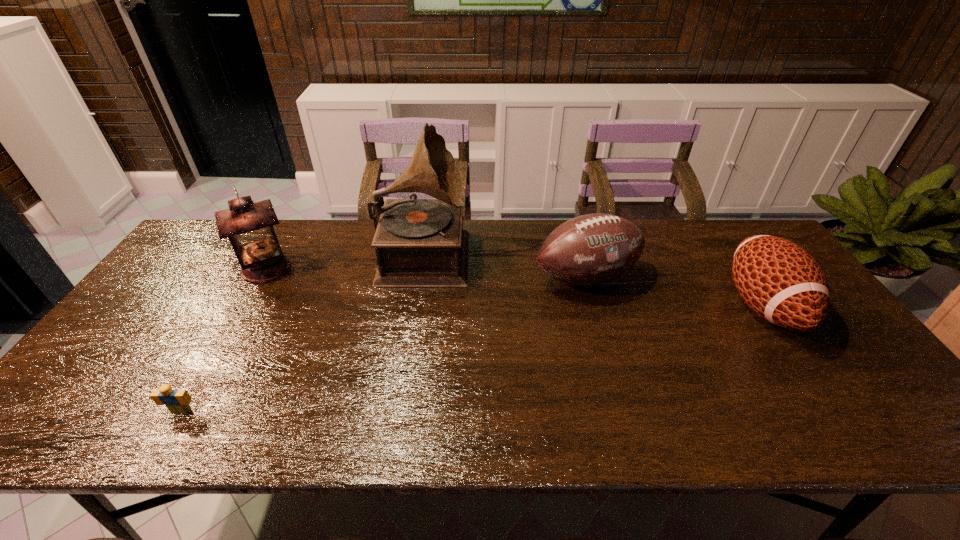
I want to click on the third object from right to left, so click(418, 242).

Identify the location of the tallest object. (418, 242).

Where is `oil lamp`? Image resolution: width=960 pixels, height=540 pixels. oil lamp is located at coordinates (248, 225).

Locate an element on the screen. This screenshot has width=960, height=540. the fourth object from left to right is located at coordinates [591, 249].

Where is `the rightmost object`? The width and height of the screenshot is (960, 540). the rightmost object is located at coordinates (780, 281).

At what (x,y) coordinates should I click in order to perform the action: click on Lego. Please return your answer as a coordinate pair (x, y). Image resolution: width=960 pixels, height=540 pixels. Looking at the image, I should click on (177, 401).

Identify the location of the nearest object. Image resolution: width=960 pixels, height=540 pixels. (177, 401).

This screenshot has height=540, width=960. I want to click on free space located from the horn of the third object from left to right, so click(x=518, y=252).

The height and width of the screenshot is (540, 960). I want to click on vacant space located on the front of the oil lamp, so click(231, 329).

Where is `free region located 0.150m on the back of the left football`? free region located 0.150m on the back of the left football is located at coordinates click(572, 228).